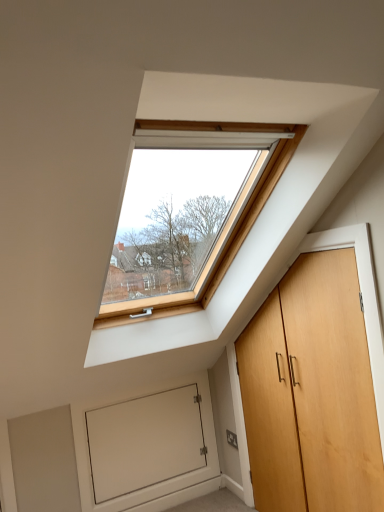
Question: Visually, is white matte door at lower left positioned to the left or to the right of light brown wood door at right?

Choices:
 (A) right
 (B) left

Answer: (B)

Question: Is white matte door at lower left spatially inside light brown wood door at right, or outside of it?

Choices:
 (A) inside
 (B) outside

Answer: (B)

Question: Considering their positions, is white matte door at lower left located in front of or behind light brown wood door at right?

Choices:
 (A) front
 (B) behind

Answer: (B)

Question: Is point (314, 478) closer or farther from the camera than point (190, 439)?

Choices:
 (A) closer
 (B) farther

Answer: (A)

Question: From their relative heights in the image, would you say light brown wood door at right is taller or shorter than white matte door at lower left?

Choices:
 (A) tall
 (B) short

Answer: (A)

Question: In terms of size, does light brown wood door at right appear bigger or smaller than white matte door at lower left?

Choices:
 (A) small
 (B) big

Answer: (B)

Question: Considering the positions of light brown wood door at right and white matte door at lower left in the image, is light brown wood door at right wider or thinner than white matte door at lower left?

Choices:
 (A) wide
 (B) thin

Answer: (A)